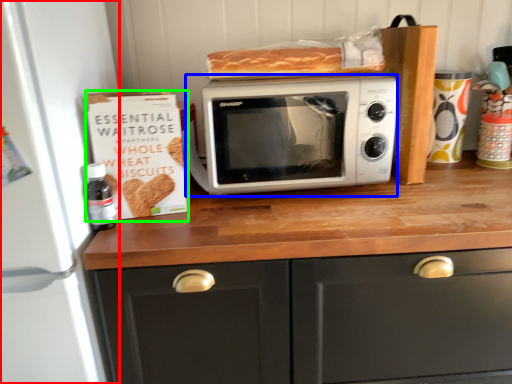
Question: Which object is the closest to the appliance (highlighted by a red box)? Choose among these: microwave oven (highlighted by a blue box) or cardboard box (highlighted by a green box).

Choices:
 (A) microwave oven
 (B) cardboard box

Answer: (B)